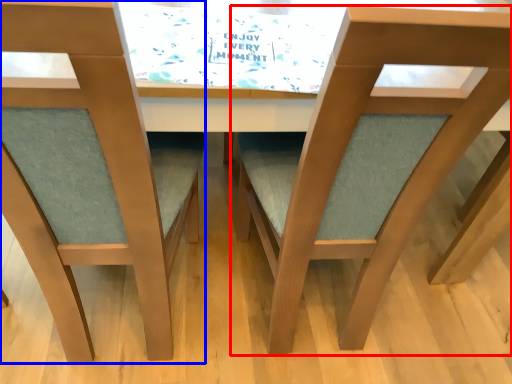
Question: Which of the following is the closest to the observer, chair (highlighted by a red box) or chair (highlighted by a blue box)?

Choices:
 (A) chair
 (B) chair

Answer: (B)